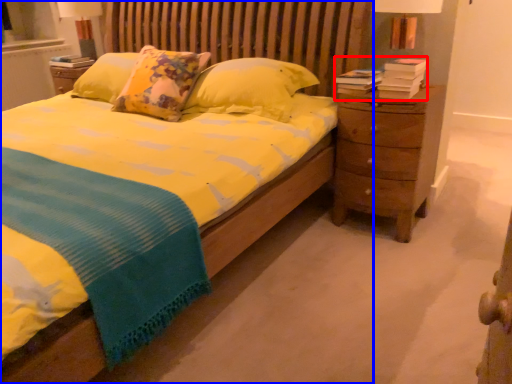
Question: Which point is closer to the camera, book (highlighted by a red box) or bed (highlighted by a blue box)?

Choices:
 (A) book
 (B) bed

Answer: (B)